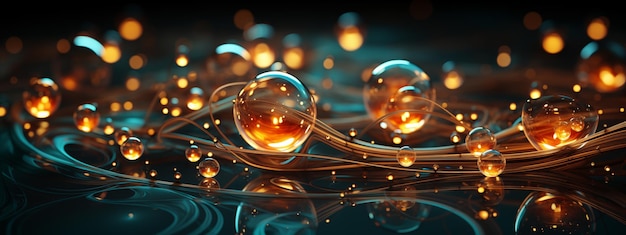
Find the location of `reflective surface`. reflective surface is located at coordinates (228, 213).